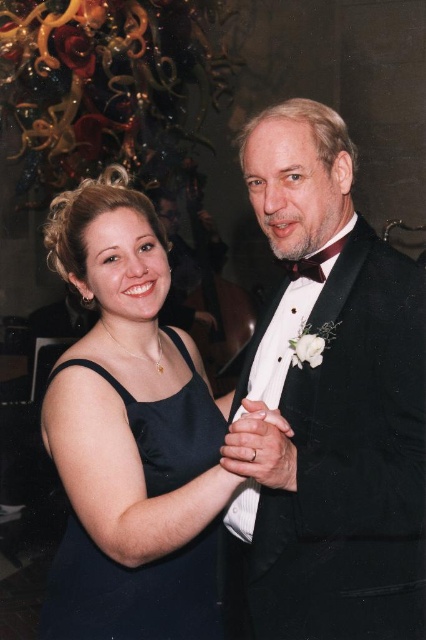
Between point (192, 564) and point (288, 269), which one is positioned behind?

Point (288, 269)

How distant is satin black dress at center from bow tie at center?

26.37 inches

The image size is (426, 640). Describe the element at coordinates (134, 592) in the screenshot. I see `satin black dress at center` at that location.

Identify the location of satin black dress at center. Image resolution: width=426 pixels, height=640 pixels. (134, 592).

Which is in front, point (314, 141) or point (187, 570)?

Point (314, 141) is more forward.

Between black satin tuxedo at right and satin black dress at center, which one appears on the right side from the viewer's perspective?

black satin tuxedo at right is more to the right.

Does point (367, 595) lie in front of point (209, 552)?

Yes, point (367, 595) is closer to viewer.

This screenshot has width=426, height=640. Identify the location of black satin tuxedo at right. (331, 403).

Between black satin tuxedo at right and bow tie at center, which one appears on the right side from the viewer's perspective?

black satin tuxedo at right

Can you confirm if black satin tuxedo at right is wider than bow tie at center?

Yes, black satin tuxedo at right is wider than bow tie at center.

Measure the distance between point (296, 154) and camera.

Point (296, 154) and camera are 4.68 feet apart.

Locate an element on the screen. This screenshot has width=426, height=640. black satin tuxedo at right is located at coordinates tap(331, 403).